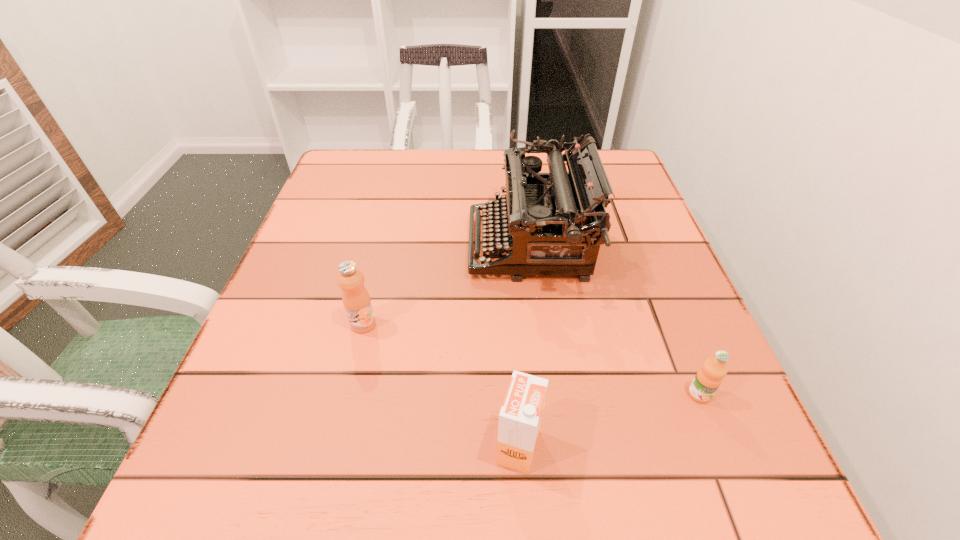
Identify the location of typewriter. The image size is (960, 540). (554, 223).

Where is `the tallest object`? The image size is (960, 540). the tallest object is located at coordinates (554, 223).

The width and height of the screenshot is (960, 540). Find the location of `the farthest orange juice`. the farthest orange juice is located at coordinates (356, 300).

You are a GUI agent. You are given a task and a screenshot of the screen. Output one action in this format:
    pyautogui.click(x=<x>, y=<y>)
    Task: Click on the second farthest object
    This screenshot has height=540, width=960.
    Given the screenshot: What is the action you would take?
    pyautogui.click(x=356, y=300)

Find the location of a particular element. the nearest orange juice is located at coordinates (520, 417).

The width and height of the screenshot is (960, 540). In order to click on the nearest object in this screenshot , I will do `click(520, 417)`.

In order to click on the rightmost object in this screenshot , I will do `click(709, 377)`.

Where is `the shortest object`? the shortest object is located at coordinates 709,377.

Identify the location of free space located on the keyboard of the typewriter. The image size is (960, 540). (373, 245).

You are a GUI agent. You are given a task and a screenshot of the screen. Output one action in this format:
    pyautogui.click(x=<x>, y=<y>)
    Task: Click on the vacant space located on the keyboard of the typewriter
    The width and height of the screenshot is (960, 540).
    Given the screenshot: What is the action you would take?
    pyautogui.click(x=421, y=245)